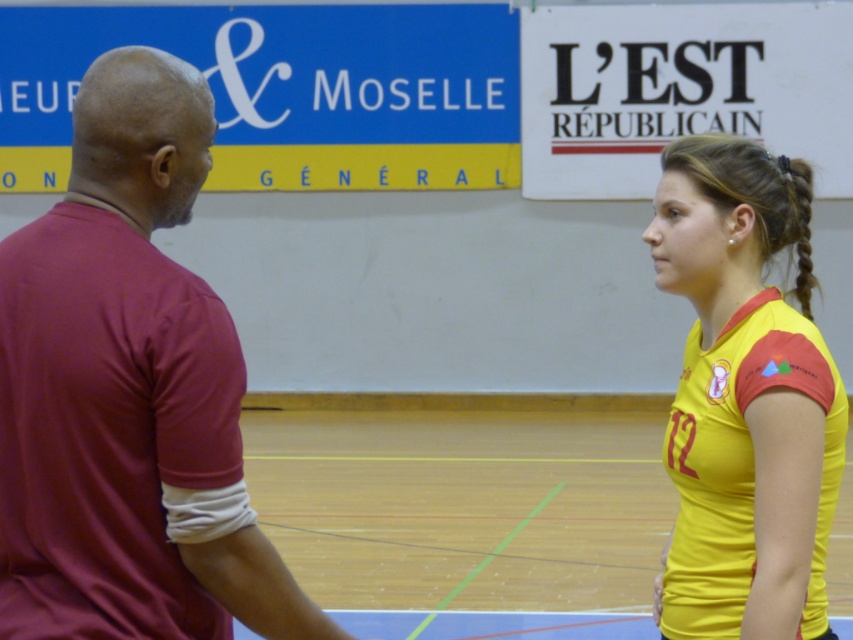
Based on the photo, you are a photographer positioned at the center of the sports hall. You need to capture a photo where both the maroon jersey at left and the yellow jersey at right are visible. Considering their heights, which jersey should you position closer to the camera to ensure both are fully visible in the frame?

The maroon jersey at left is much taller than the yellow jersey at right, so to ensure both are fully visible in the frame, position the yellow jersey at right closer to the camera. This way, the shorter yellow jersey at right won